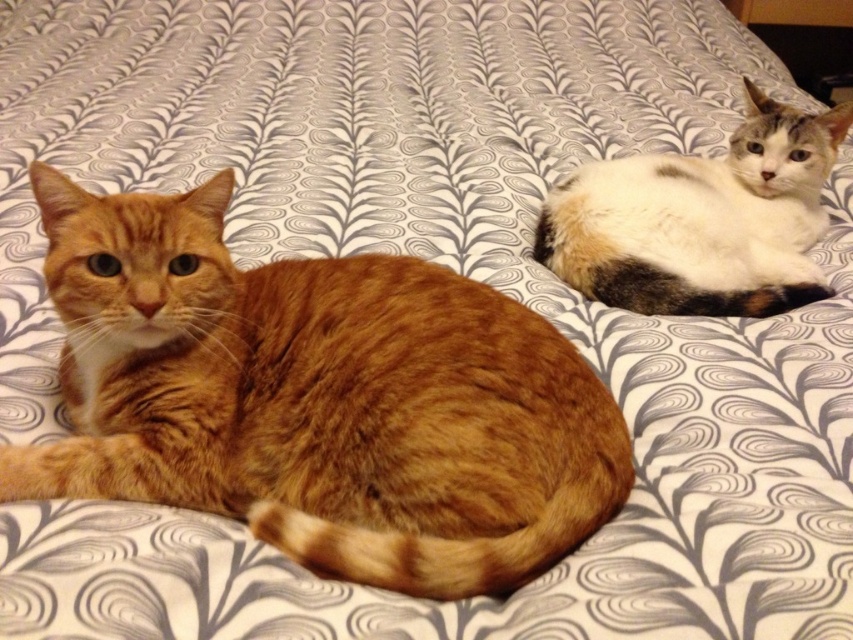
Question: Is orange fur cat at left to the right of calico fur cat at upper right from the viewer's perspective?

Choices:
 (A) yes
 (B) no

Answer: (B)

Question: Which of the following is the closest to the observer?

Choices:
 (A) (751, 148)
 (B) (218, 428)

Answer: (B)

Question: Is orange fur cat at left thinner than calico fur cat at upper right?

Choices:
 (A) no
 (B) yes

Answer: (A)

Question: Among these points, which one is farthest from the camera?

Choices:
 (A) (408, 467)
 (B) (651, 273)

Answer: (B)

Question: Does orange fur cat at left have a lesser width compared to calico fur cat at upper right?

Choices:
 (A) yes
 (B) no

Answer: (B)